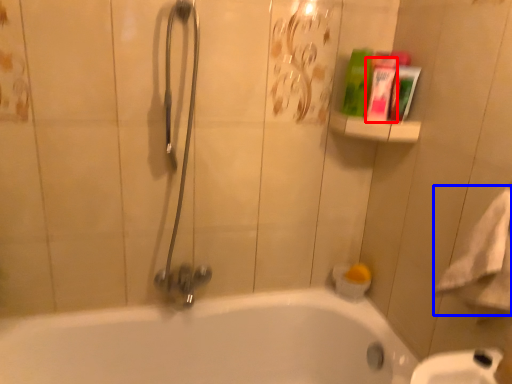
Question: Which object is further to the camera taking this photo, mouthwash (highlighted by a red box) or bath towel (highlighted by a blue box)?

Choices:
 (A) mouthwash
 (B) bath towel

Answer: (A)